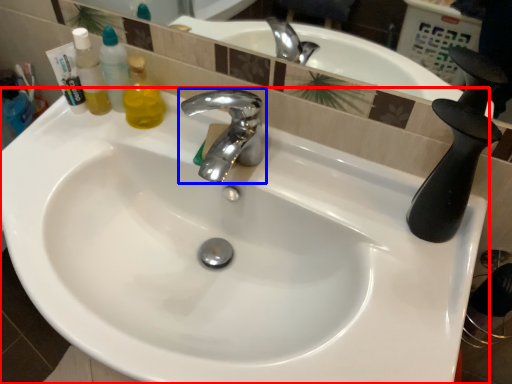
Question: Among these objects, which one is farthest to the camera, sink (highlighted by a red box) or tap (highlighted by a blue box)?

Choices:
 (A) sink
 (B) tap

Answer: (B)